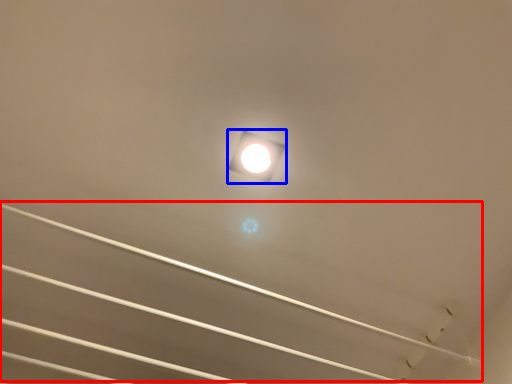
Question: Which object appears farthest to the camera in this image, line (highlighted by a red box) or lamp (highlighted by a blue box)?

Choices:
 (A) line
 (B) lamp

Answer: (B)